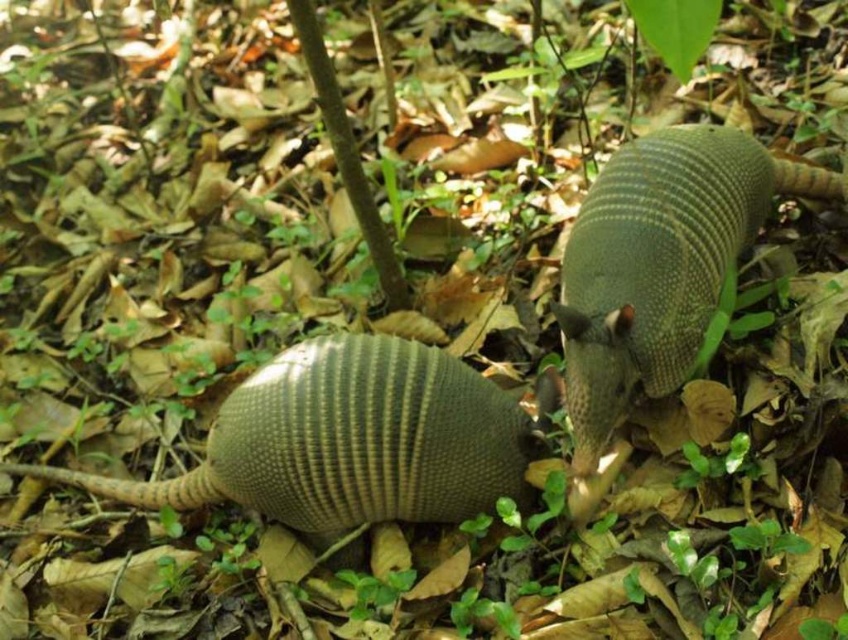
Can you confirm if brown textured armadillo at lower left is wider than green textured armadillo at center?

Indeed, brown textured armadillo at lower left has a greater width compared to green textured armadillo at center.

Looking at this image, can you confirm if brown textured armadillo at lower left is positioned above green textured armadillo at center?

Actually, brown textured armadillo at lower left is below green textured armadillo at center.

Is point (349, 488) farther from viewer compared to point (593, 250)?

Yes, point (349, 488) is behind point (593, 250).

Find the location of a particular element. brown textured armadillo at lower left is located at coordinates (349, 442).